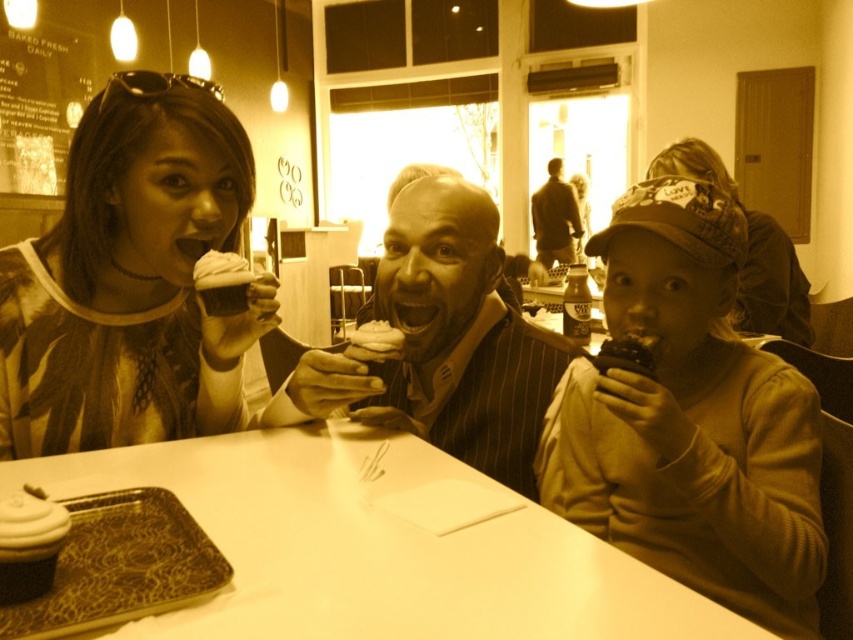
Does matte chocolate cupcake at lower left have a lesser height compared to brown leather jacket at upper center?

Indeed, matte chocolate cupcake at lower left has a lesser height compared to brown leather jacket at upper center.

The width and height of the screenshot is (853, 640). I want to click on matte chocolate cupcake at lower left, so click(28, 544).

Does white glossy table at center have a lesser width compared to matte white cupcake at center?

In fact, white glossy table at center might be wider than matte white cupcake at center.

Image resolution: width=853 pixels, height=640 pixels. Identify the location of white glossy table at center. [380, 545].

At what (x,y) coordinates should I click in order to perform the action: click on white glossy table at center. Please return your answer as a coordinate pair (x, y). The image size is (853, 640). Looking at the image, I should click on (380, 545).

Is white glossy table at center smaller than brown leather jacket at upper center?

Yes, white glossy table at center is smaller than brown leather jacket at upper center.

Is white glossy table at center positioned before brown leather jacket at upper center?

Yes, white glossy table at center is in front of brown leather jacket at upper center.

Is point (618, 579) farther from camera compared to point (534, 236)?

No, it is not.

You are a GUI agent. You are given a task and a screenshot of the screen. Output one action in this format:
    pyautogui.click(x=<x>, y=<y>)
    Task: Click on the white glossy table at center
    The image size is (853, 640).
    Given the screenshot: What is the action you would take?
    pyautogui.click(x=380, y=545)